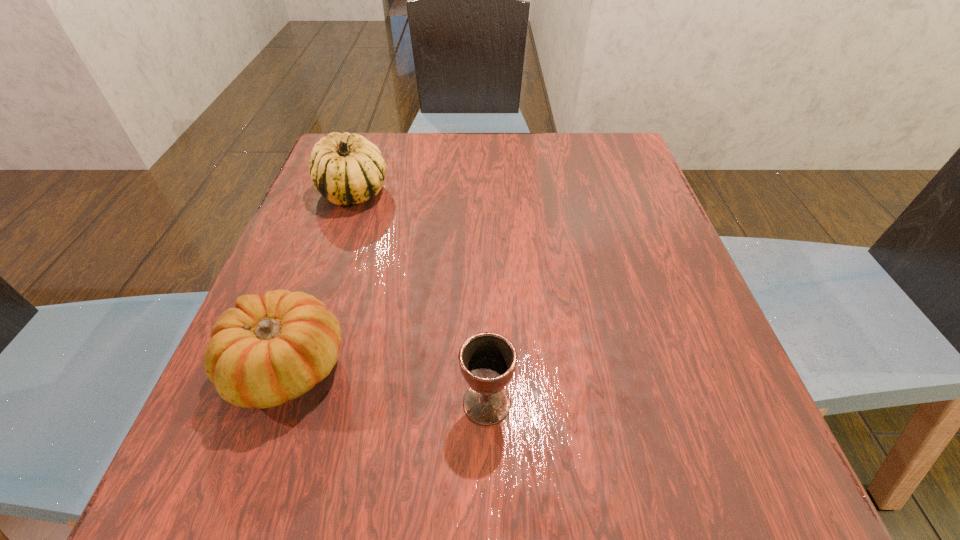
Image resolution: width=960 pixels, height=540 pixels. In order to click on free space at the right edge of the desktop in this screenshot , I will do `click(644, 247)`.

Identify the location of vacant area at the far left corner of the desktop. (396, 134).

In the image, there is a desktop. Identify the location of vacant area at the near left corner. (255, 456).

Locate an element on the screen. vacant space at the far right corner of the desktop is located at coordinates (579, 161).

Locate an element on the screen. The image size is (960, 540). empty space that is in between the chalice and the farther gourd is located at coordinates (420, 298).

You are a GUI agent. You are given a task and a screenshot of the screen. Output one action in this format:
    pyautogui.click(x=<x>, y=<y>)
    Task: Click on the free spot between the farthest object and the rightmost object
    This screenshot has height=540, width=960.
    Given the screenshot: What is the action you would take?
    pyautogui.click(x=420, y=298)

You are a GUI agent. You are given a task and a screenshot of the screen. Output one action in this format:
    pyautogui.click(x=<x>, y=<y>)
    Task: Click on the vacant space in between the farther gourd and the chalice
    This screenshot has height=540, width=960.
    Given the screenshot: What is the action you would take?
    pyautogui.click(x=420, y=298)

You are a GUI agent. You are given a task and a screenshot of the screen. Output one action in this format:
    pyautogui.click(x=<x>, y=<y>)
    Task: Click on the free area in between the farther gourd and the shorter gourd
    This screenshot has width=960, height=540.
    Given the screenshot: What is the action you would take?
    pyautogui.click(x=320, y=279)

Where is `vacant space that is in between the shorter gourd and the rightmost object`? The height and width of the screenshot is (540, 960). vacant space that is in between the shorter gourd and the rightmost object is located at coordinates (387, 385).

Image resolution: width=960 pixels, height=540 pixels. In order to click on free spot between the rightmost object and the farthest object in this screenshot , I will do `click(420, 298)`.